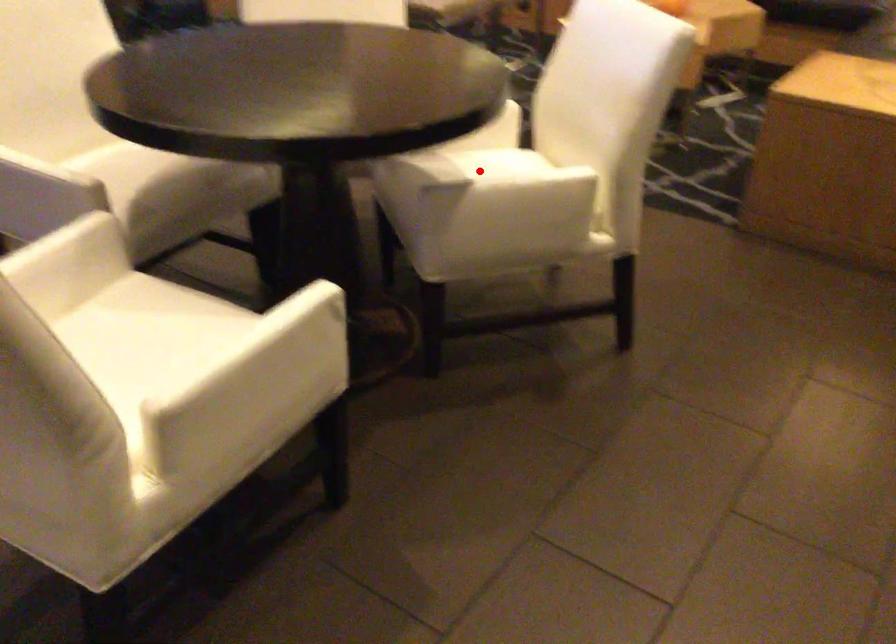
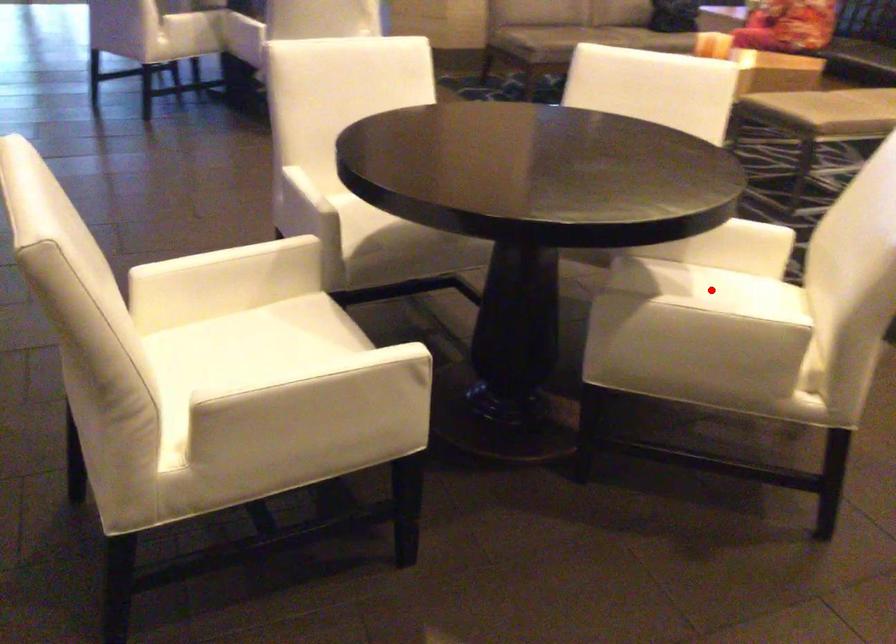
I am providing you with two images of the same scene from different viewpoints. A red point is marked on the first image and another point is marked on the second image. Does the point marked in image1 correspond to the same location as the one in image2?

Yes